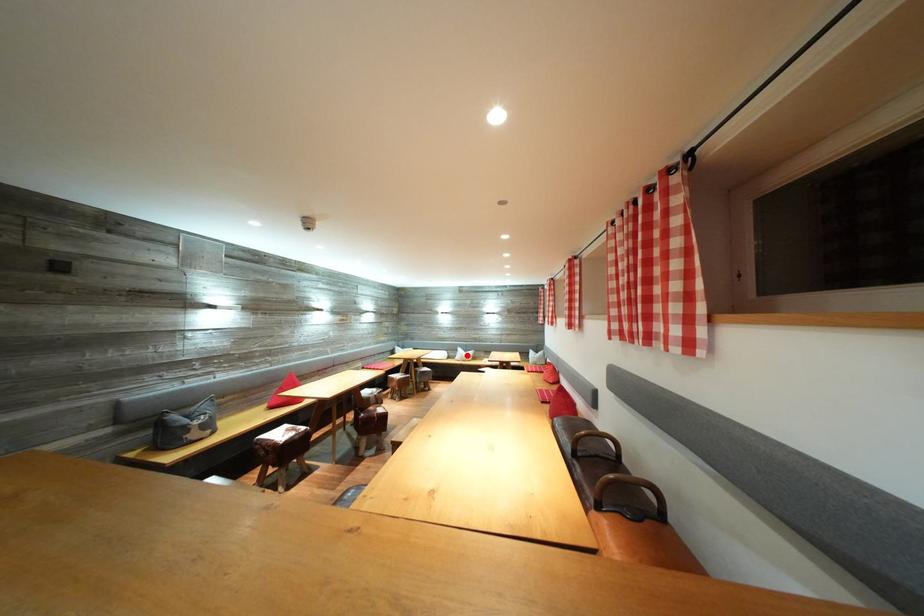
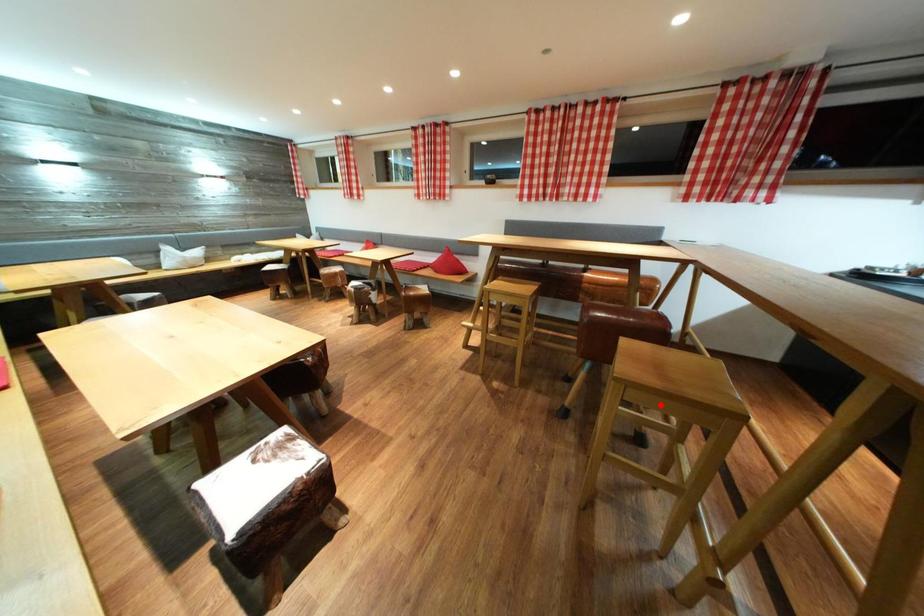
I am providing you with two images of the same scene from different viewpoints. A red point is marked on the first image and another point is marked on the second image. Is the red point in image1 aligned with the point shown in image2?

No